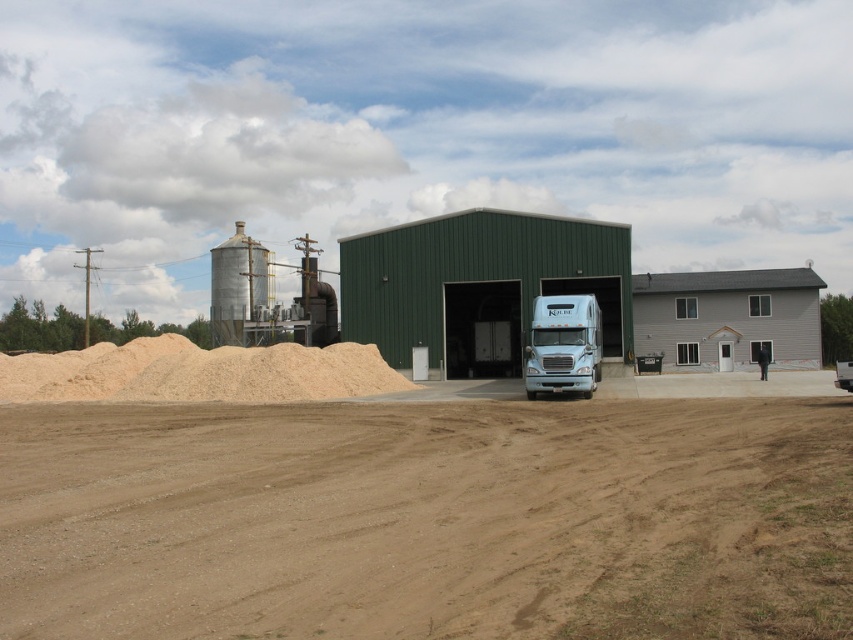
Question: Observing the image, what is the correct spatial positioning of gray matte house at right in reference to light blue metallic trailer truck at center?

Choices:
 (A) below
 (B) above

Answer: (B)

Question: Can you confirm if green metal/glass barn at center is positioned to the left of light blue metallic trailer truck at center?

Choices:
 (A) yes
 (B) no

Answer: (A)

Question: Which point is closer to the camera taking this photo?

Choices:
 (A) (535, 387)
 (B) (397, 244)
 (C) (590, 620)

Answer: (C)

Question: Can you confirm if brown sandy dirt at center is positioned below green metal/glass barn at center?

Choices:
 (A) yes
 (B) no

Answer: (A)

Question: Which point is closer to the camera?

Choices:
 (A) (519, 404)
 (B) (601, 364)
 (C) (699, 323)
 (D) (477, 285)

Answer: (A)

Question: Which point appears farthest from the camera in this image?

Choices:
 (A) [740, 298]
 (B) [550, 365]

Answer: (A)